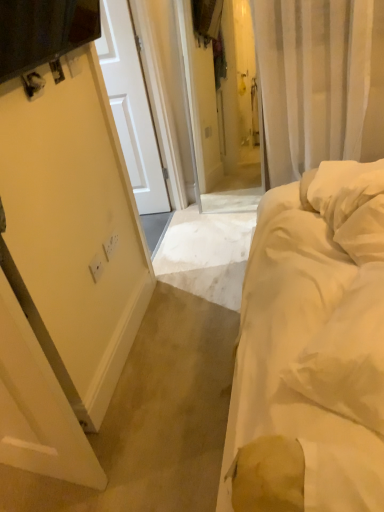
Question: From the image's perspective, would you say white soft bed at right is positioned over white plastic electric outlet at left?

Choices:
 (A) no
 (B) yes

Answer: (A)

Question: Is white soft bed at right completely or partially outside of white plastic electric outlet at left?

Choices:
 (A) yes
 (B) no

Answer: (A)

Question: Is white soft bed at right facing towards white plastic electric outlet at left?

Choices:
 (A) no
 (B) yes

Answer: (B)

Question: From a real-world perspective, does white soft bed at right sit lower than white plastic electric outlet at left?

Choices:
 (A) yes
 (B) no

Answer: (A)

Question: Considering the relative positions of white soft bed at right and white plastic electric outlet at left in the image provided, is white soft bed at right behind white plastic electric outlet at left?

Choices:
 (A) yes
 (B) no

Answer: (B)

Question: Is white soft bed at right beside white plastic electric outlet at left?

Choices:
 (A) yes
 (B) no

Answer: (B)

Question: Does white plastic electric outlet at left appear on the left side of white soft bed at right?

Choices:
 (A) yes
 (B) no

Answer: (A)

Question: Is white plastic electric outlet at left at the right side of white soft bed at right?

Choices:
 (A) yes
 (B) no

Answer: (B)

Question: Does white plastic electric outlet at left lie in front of white soft bed at right?

Choices:
 (A) yes
 (B) no

Answer: (B)

Question: Is white plastic electric outlet at left further to camera compared to white soft bed at right?

Choices:
 (A) yes
 (B) no

Answer: (A)

Question: Is white plastic electric outlet at left facing away from white soft bed at right?

Choices:
 (A) yes
 (B) no

Answer: (B)

Question: Is white plastic electric outlet at left outside white soft bed at right?

Choices:
 (A) yes
 (B) no

Answer: (A)

Question: In terms of height, does white soft bed at right look taller or shorter compared to white plastic electric outlet at left?

Choices:
 (A) tall
 (B) short

Answer: (A)